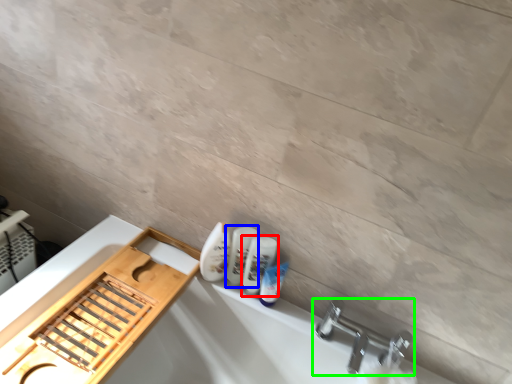
Question: Which object is positioned closest to mouthwash (highlighted by a red box)? Select from mouthwash (highlighted by a blue box) and tap (highlighted by a green box).

Choices:
 (A) mouthwash
 (B) tap

Answer: (A)